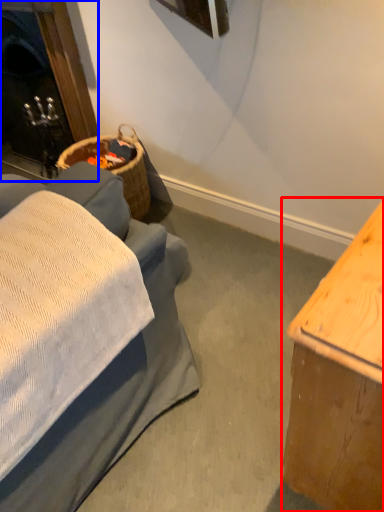
Question: Which of the following is the farthest to the observer, table (highlighted by a red box) or fireplace (highlighted by a blue box)?

Choices:
 (A) table
 (B) fireplace

Answer: (B)